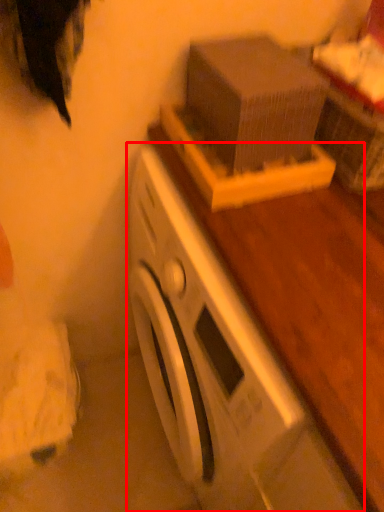
Question: In this image, where is washing machine (annotated by the red box) located relative to box?

Choices:
 (A) left
 (B) right

Answer: (B)